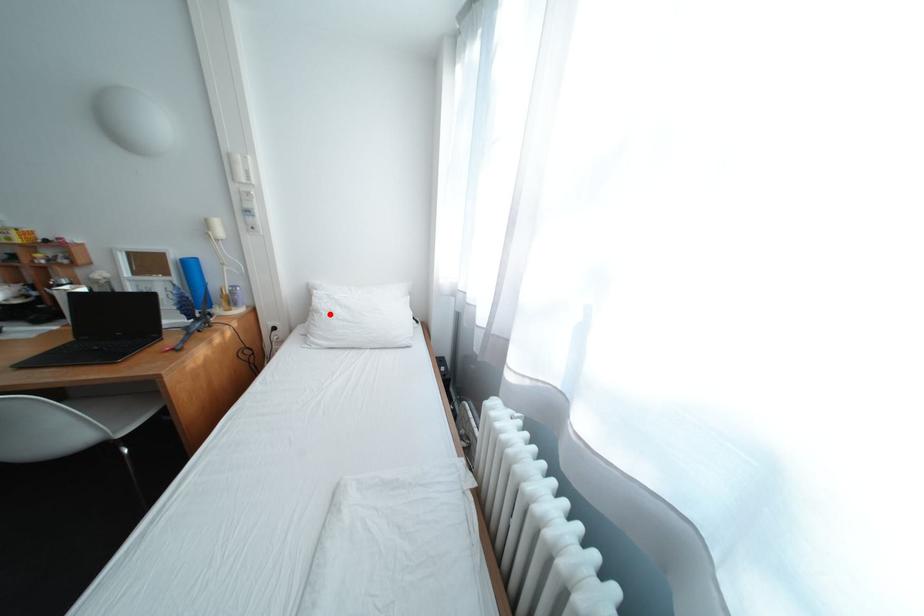
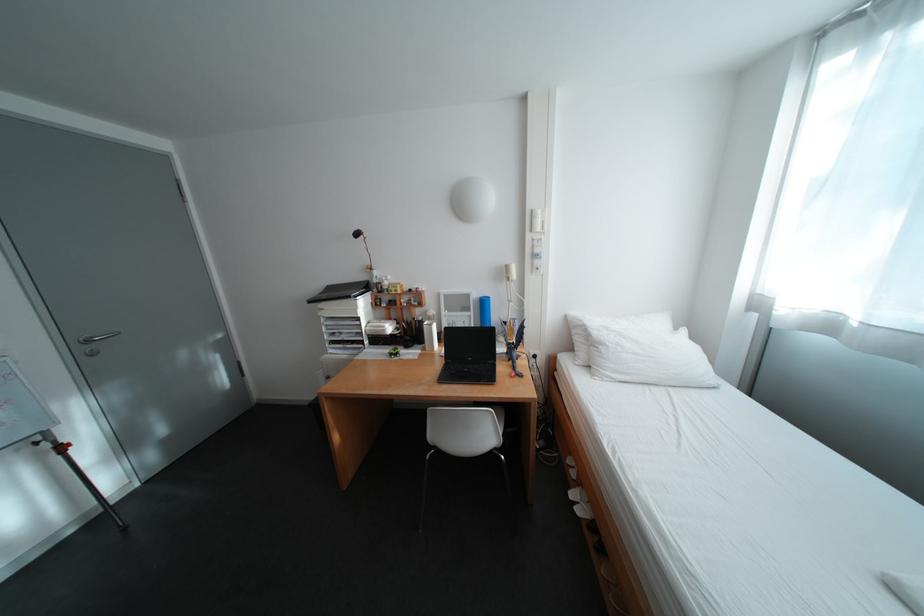
In the second image, find the point that corresponds to the highlighted location in the first image.

(614, 346)